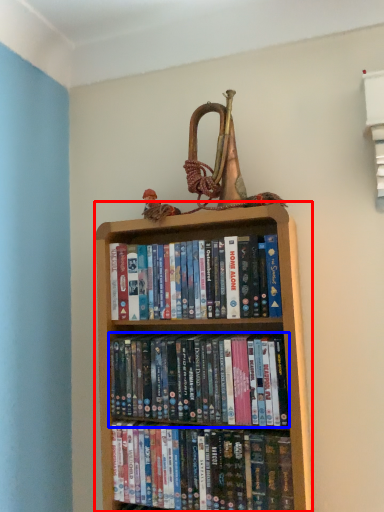
Question: Which object appears closest to the camera in this image, bookcase (highlighted by a red box) or book (highlighted by a blue box)?

Choices:
 (A) bookcase
 (B) book

Answer: (A)